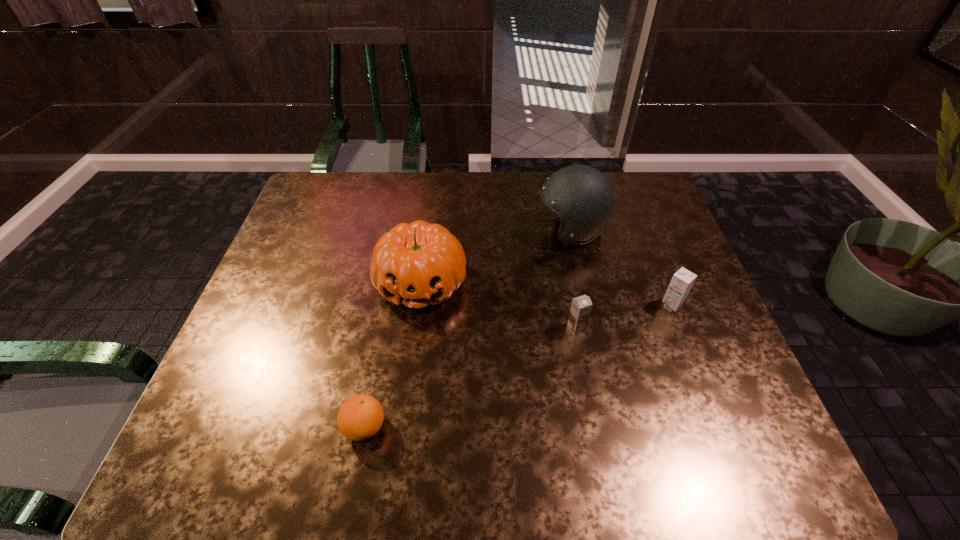
Find the location of `free space that satisfies the following two spatial constraints: 1. at the face opening of the tallest object; 2. on the back side of the rightmost object`. free space that satisfies the following two spatial constraints: 1. at the face opening of the tallest object; 2. on the back side of the rightmost object is located at coordinates (588, 306).

The width and height of the screenshot is (960, 540). In order to click on blank area in the image that satisfies the following two spatial constraints: 1. on the carved face of the pumpkin; 2. on the right side of the nearer chocolate milk in this screenshot , I will do `click(416, 328)`.

You are a GUI agent. You are given a task and a screenshot of the screen. Output one action in this format:
    pyautogui.click(x=<x>, y=<y>)
    Task: Click on the blank space that satisfies the following two spatial constraints: 1. at the face opening of the tallest object; 2. on the carved face of the second tallest object
    This screenshot has height=540, width=960.
    Given the screenshot: What is the action you would take?
    pyautogui.click(x=583, y=282)